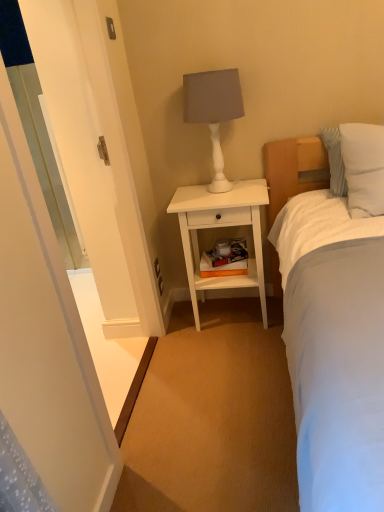
Locate an element on the screen. The image size is (384, 512). free point in front of white matte nightstand at center is located at coordinates (228, 359).